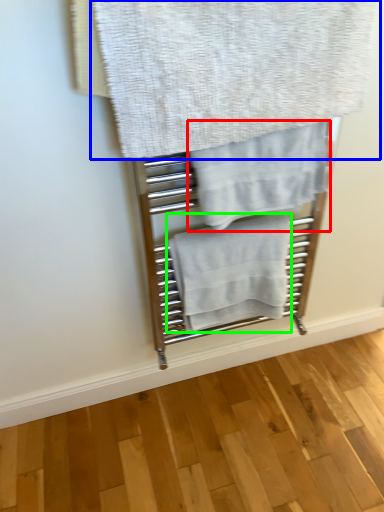
Question: Which object is the farthest from towel (highlighted by a red box)? Choose among these: towel (highlighted by a blue box) or towel (highlighted by a green box).

Choices:
 (A) towel
 (B) towel

Answer: (B)